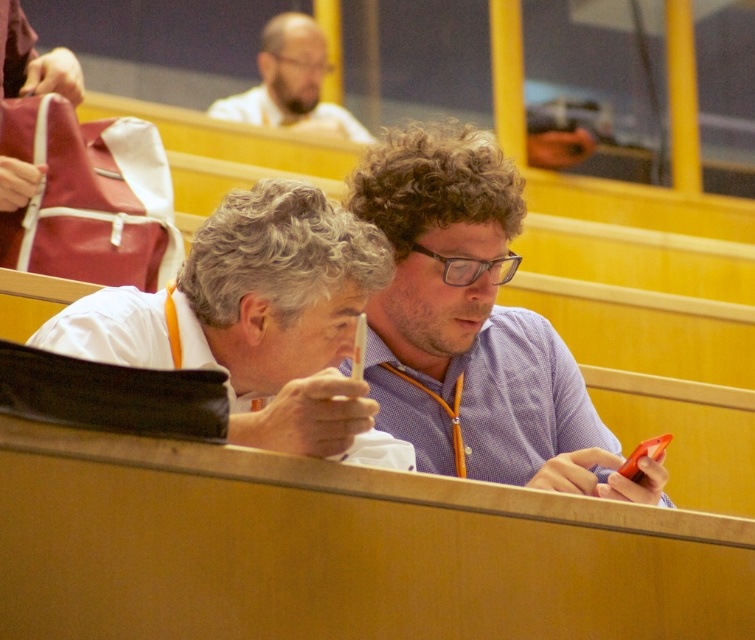
Does purple checkered shirt at center come in front of matte white shirt at upper center?

Yes, it is in front of matte white shirt at upper center.

Does purple checkered shirt at center have a greater width compared to matte white shirt at upper center?

No, purple checkered shirt at center is not wider than matte white shirt at upper center.

Find the location of a particular element. The width and height of the screenshot is (755, 640). purple checkered shirt at center is located at coordinates (472, 326).

Where is `purple checkered shirt at center`? This screenshot has height=640, width=755. purple checkered shirt at center is located at coordinates (472, 326).

Can you confirm if white matte shirt at center is bigger than matte white shirt at upper center?

No, white matte shirt at center is not bigger than matte white shirt at upper center.

Between point (304, 317) and point (264, 26), which one is positioned in front?

Point (304, 317) is in front.

Find the location of a particular element. The width and height of the screenshot is (755, 640). white matte shirt at center is located at coordinates (257, 321).

This screenshot has width=755, height=640. In order to click on white matte shirt at center in this screenshot , I will do `click(257, 321)`.

Can you confirm if purple checkered shirt at center is shorter than white matte shirt at center?

Incorrect, purple checkered shirt at center's height does not fall short of white matte shirt at center's.

Is purple checkered shirt at center closer to the viewer compared to white matte shirt at center?

No, it is not.

Who is more distant from viewer, (401, 324) or (328, 330)?

Positioned behind is point (401, 324).

This screenshot has width=755, height=640. I want to click on purple checkered shirt at center, so click(x=472, y=326).